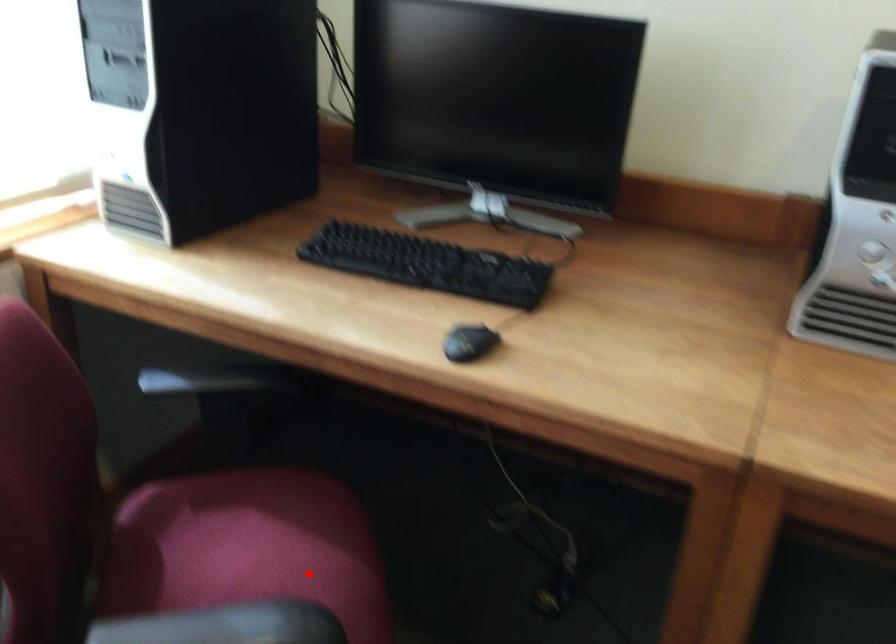
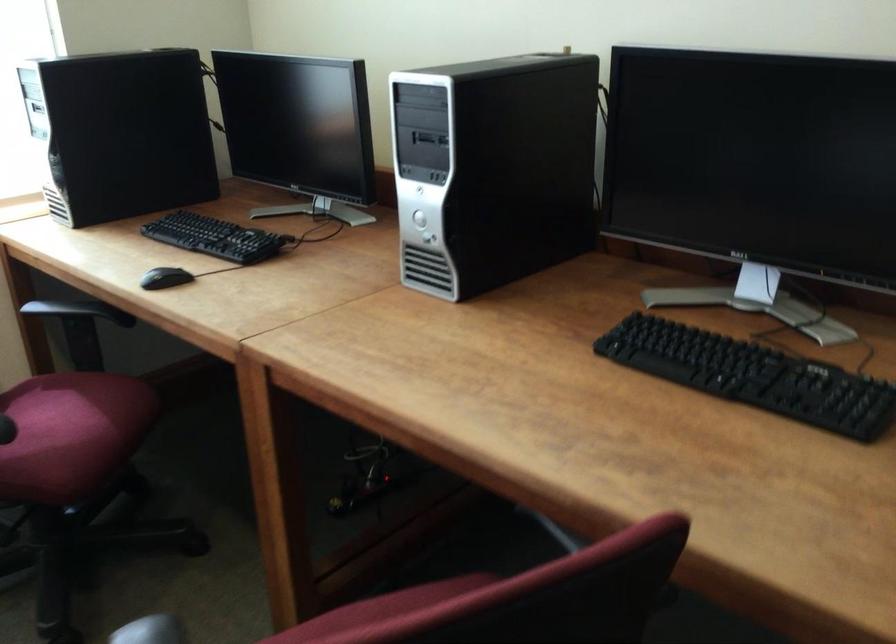
Locate, in the second image, the point that corresponds to the highlighted location in the first image.

(73, 428)